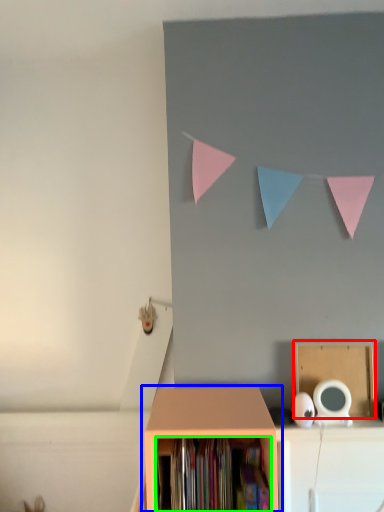
Question: Which is nearer to the cardboard box (highlighted by a red box)? shelf (highlighted by a blue box) or book (highlighted by a green box).

Choices:
 (A) shelf
 (B) book

Answer: (A)